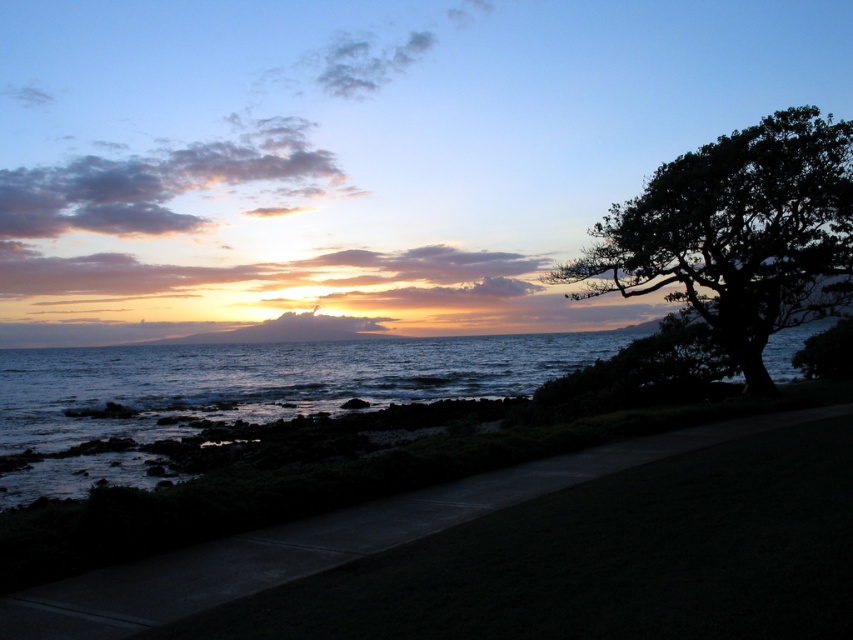
Question: Which object is farther from the camera taking this photo?

Choices:
 (A) dark green leafy tree at right
 (B) dark blue water at center

Answer: (B)

Question: Does dark blue water at center appear on the right side of dark green leafy tree at right?

Choices:
 (A) yes
 (B) no

Answer: (B)

Question: Is dark blue water at center below dark green leafy tree at right?

Choices:
 (A) yes
 (B) no

Answer: (A)

Question: Is dark blue water at center wider than dark green leafy tree at right?

Choices:
 (A) yes
 (B) no

Answer: (A)